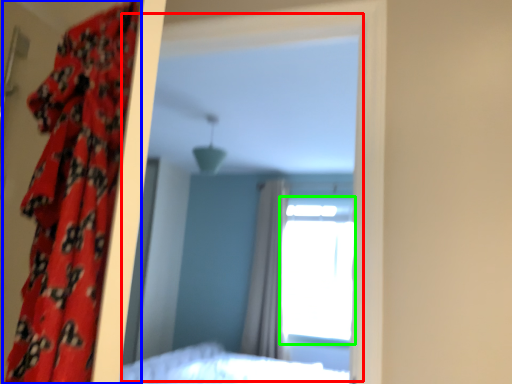
Question: Estimate the real-world distances between objects in this image. Which object is closer to mirror (highlighted by a red box), curtain (highlighted by a blue box) or window (highlighted by a green box)?

Choices:
 (A) curtain
 (B) window

Answer: (B)